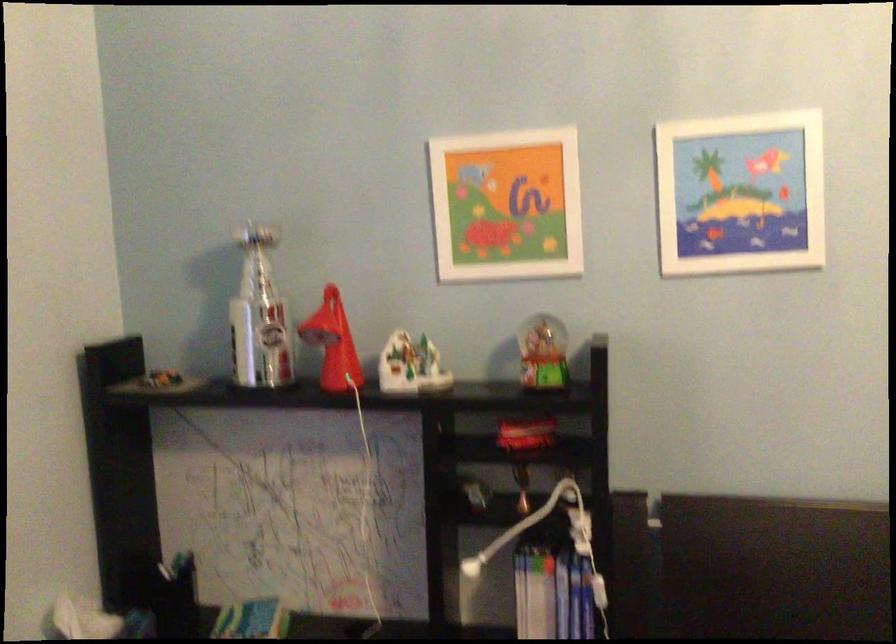
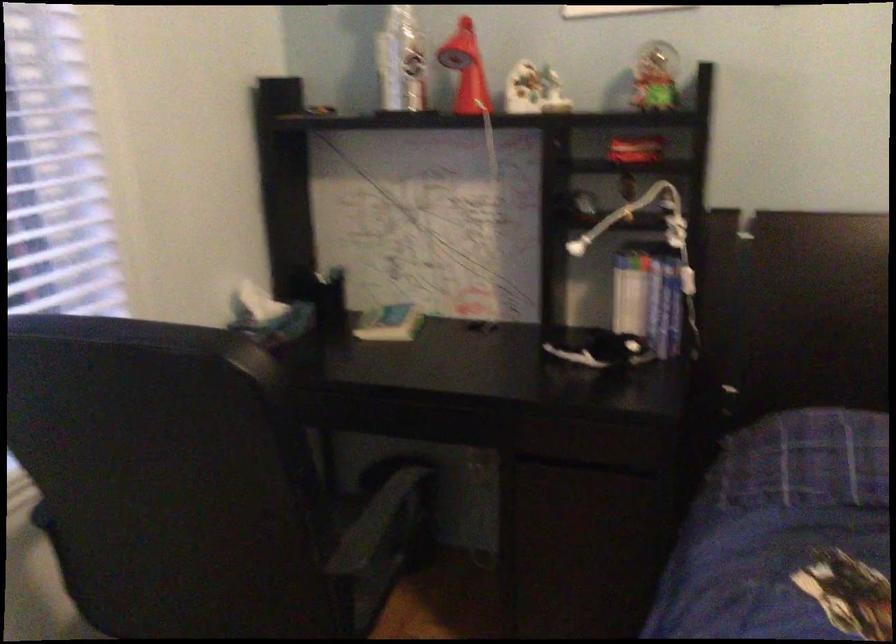
Find the pixel in the second image that matches (259,337) in the first image.

(401, 62)